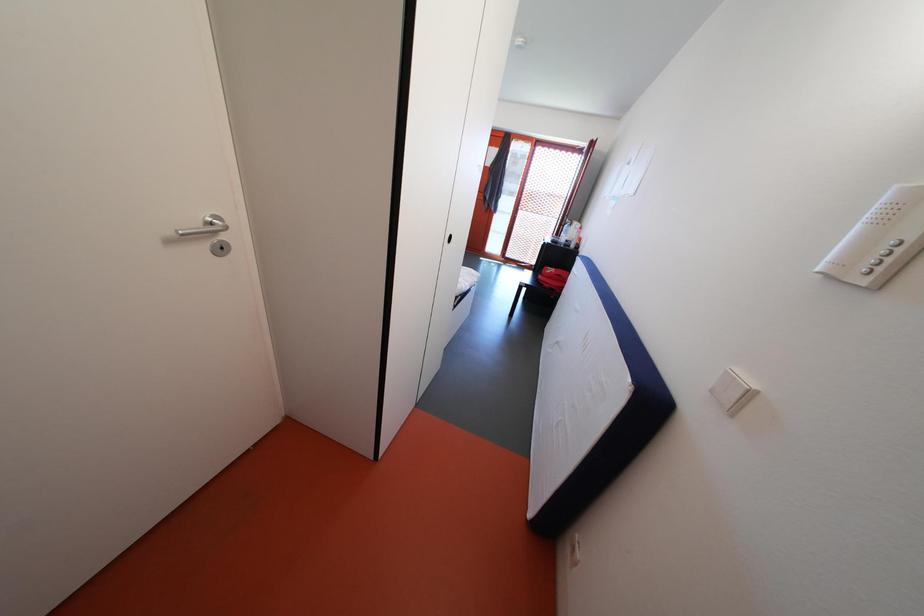
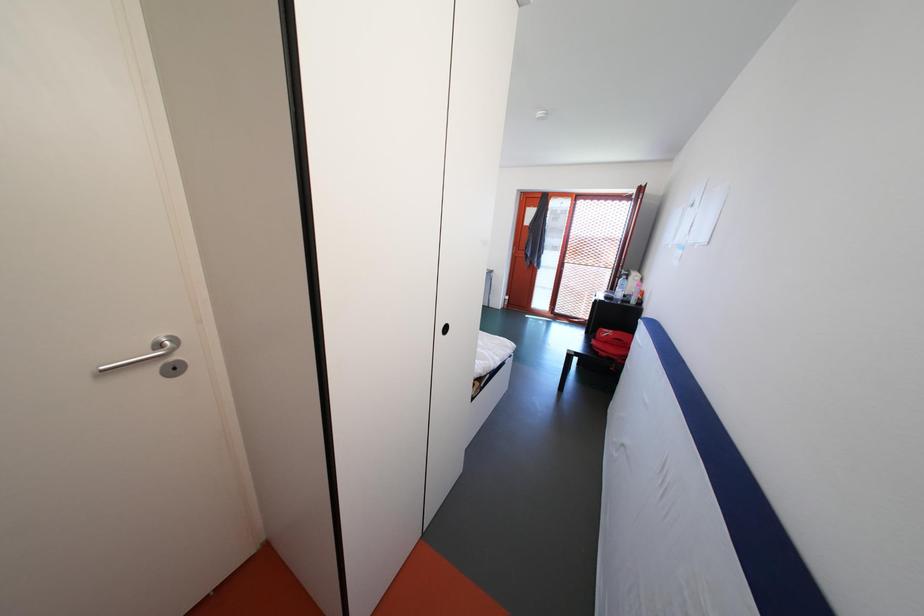
Question: Based on the continuous images, in which direction is the camera rotating? Reply with the corresponding letter.

Choices:
 (A) Left
 (B) Right
 (C) Up
 (D) Down

Answer: (A)